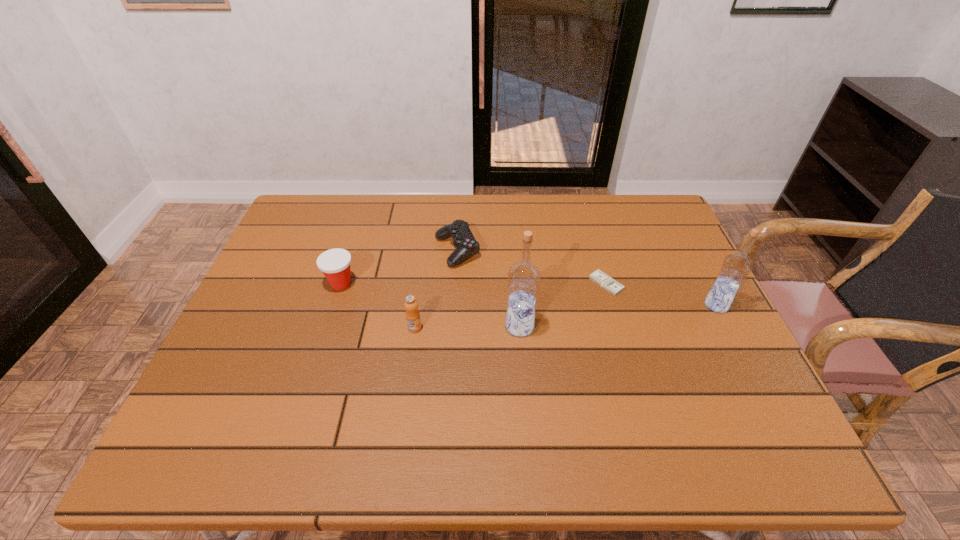
Locate an element on the screen. This screenshot has height=540, width=960. free point that keeps the vodkas evenly spaced on the left is located at coordinates (303, 350).